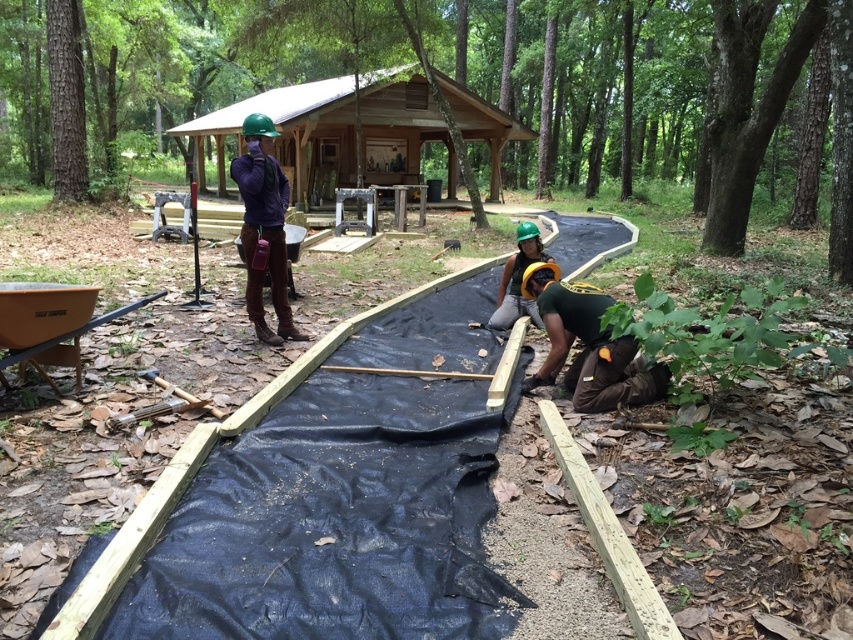
Question: Which object is the farthest from the black plastic sheeting at center?

Choices:
 (A) green matte helmet at lower right
 (B) wooden cabin at upper center
 (C) matte purple shirt at upper center
 (D) green matte helmet at center

Answer: (B)

Question: Is green matte helmet at lower right closer to camera compared to matte purple shirt at upper center?

Choices:
 (A) yes
 (B) no

Answer: (A)

Question: Can you confirm if matte purple shirt at upper center is thinner than green matte helmet at center?

Choices:
 (A) yes
 (B) no

Answer: (B)

Question: Which point appears closest to the camera in this image?

Choices:
 (A) (534, 225)
 (B) (317, 90)
 (C) (426, 285)
 (D) (254, 253)

Answer: (D)

Question: Which of the following is the closest to the observer?

Choices:
 (A) (289, 320)
 (B) (512, 307)

Answer: (A)

Question: Is black plastic sheeting at center bigger than green matte helmet at center?

Choices:
 (A) no
 (B) yes

Answer: (B)